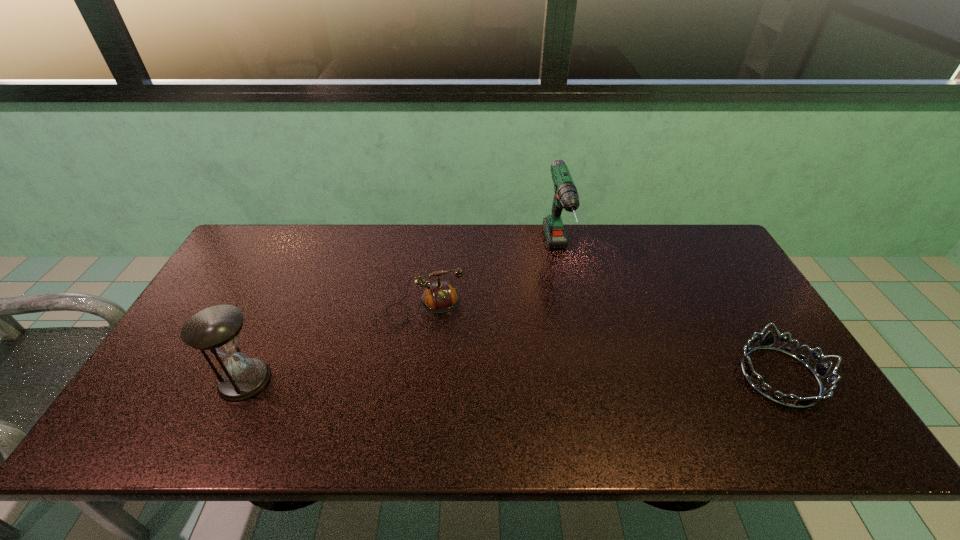
Where is `vacant space on the desktop that is between the hourglass and the rightmost object and is positioned on the rotary dial of the second object from left to right`? Image resolution: width=960 pixels, height=540 pixels. vacant space on the desktop that is between the hourglass and the rightmost object and is positioned on the rotary dial of the second object from left to right is located at coordinates (x=442, y=379).

I want to click on free space on the desktop that is between the second tallest object and the rightmost object and is positioned on the handle side of the tallest object, so click(590, 378).